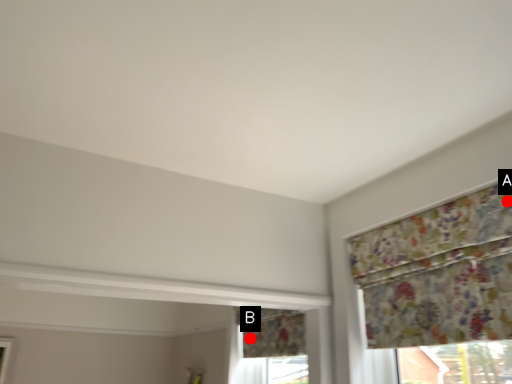
Question: Two points are circled on the image, labeled by A and B beside each circle. Which point appears farthest from the camera in this image?

Choices:
 (A) A is further
 (B) B is further

Answer: (B)